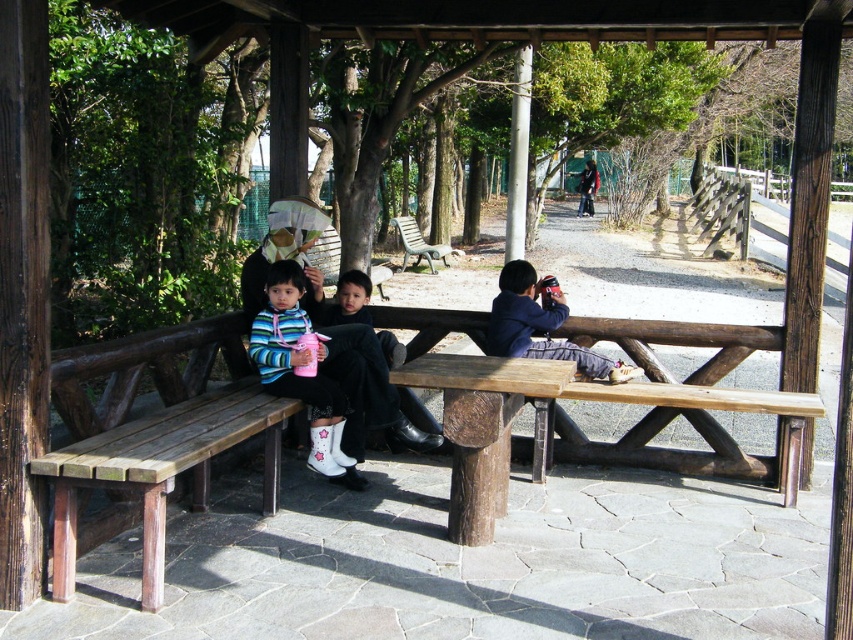
Question: Estimate the real-world distances between objects in this image. Which object is closer to the green plastic bench at center?

Choices:
 (A) blue cotton shirt at center
 (B) wooden bench at center
 (C) green leafy tree at center
 (D) striped fabric sweater at center

Answer: (C)

Question: Does green leafy tree at center lie behind blue cotton shirt at center?

Choices:
 (A) no
 (B) yes

Answer: (A)

Question: Does blue cotton shirt at center have a greater width compared to green plastic bench at center?

Choices:
 (A) no
 (B) yes

Answer: (A)

Question: Which object appears farthest from the camera in this image?

Choices:
 (A) rustic wood picnic table at center
 (B) green leafy tree at center

Answer: (B)

Question: Can you confirm if blue cotton shirt at center is positioned above striped fabric sweater at center?

Choices:
 (A) yes
 (B) no

Answer: (B)

Question: Among these objects, which one is nearest to the camera?

Choices:
 (A) striped fabric sweater at center
 (B) striped sweater at center

Answer: (B)